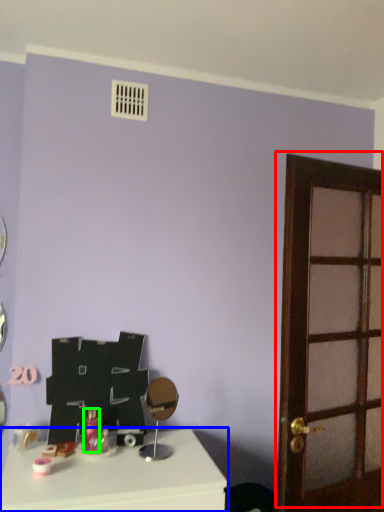
Question: Which object is positioned farthest from door (highlighted by a red box)? Select from table (highlighted by a blue box) and toiletry (highlighted by a green box).

Choices:
 (A) table
 (B) toiletry

Answer: (B)